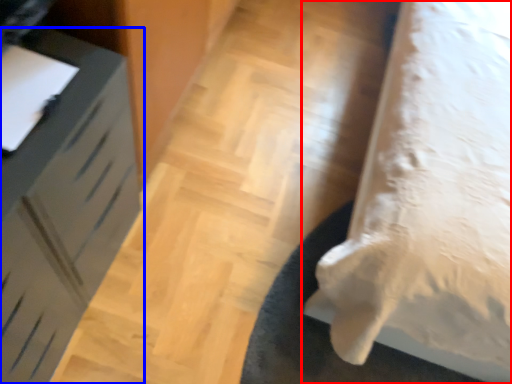
Question: Which point is further to the camera, furniture (highlighted by a red box) or furniture (highlighted by a blue box)?

Choices:
 (A) furniture
 (B) furniture

Answer: (B)